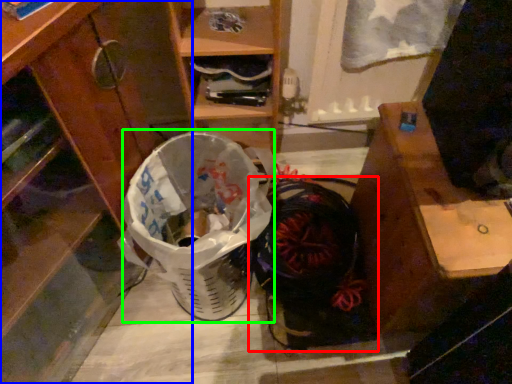
Question: Based on their relative distances, which object is farther from footwear (highlighted by a red box)? Choose from cabinetry (highlighted by a blue box) and shopping basket (highlighted by a green box).

Choices:
 (A) cabinetry
 (B) shopping basket

Answer: (A)